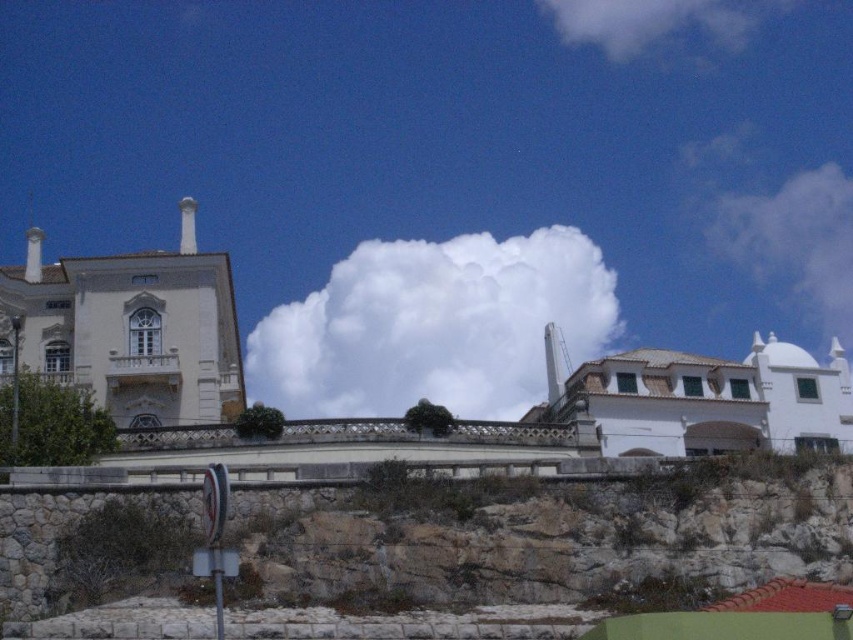
Which is more to the right, rocky cliff at lower center or white fluffy cloud at upper right?

white fluffy cloud at upper right

Does rocky cliff at lower center appear on the left side of white fluffy cloud at upper right?

Yes, rocky cliff at lower center is to the left of white fluffy cloud at upper right.

Is point (708, 552) closer to viewer compared to point (851, 212)?

Yes, point (708, 552) is closer to viewer.

Where is `rocky cliff at lower center`? rocky cliff at lower center is located at coordinates (544, 538).

Can you confirm if rocky cliff at lower center is wider than white fluffy cloud at center?

No, rocky cliff at lower center is not wider than white fluffy cloud at center.

How distant is rocky cliff at lower center from white fluffy cloud at center?

rocky cliff at lower center and white fluffy cloud at center are 132.46 meters apart from each other.

What are the coordinates of `rocky cliff at lower center` in the screenshot? It's located at (544, 538).

Identify the location of rocky cliff at lower center. Image resolution: width=853 pixels, height=640 pixels. (544, 538).

Can you confirm if white fluffy cloud at center is taller than white fluffy cloud at upper right?

No, white fluffy cloud at center is not taller than white fluffy cloud at upper right.

Identify the location of white fluffy cloud at center. The image size is (853, 640). (434, 324).